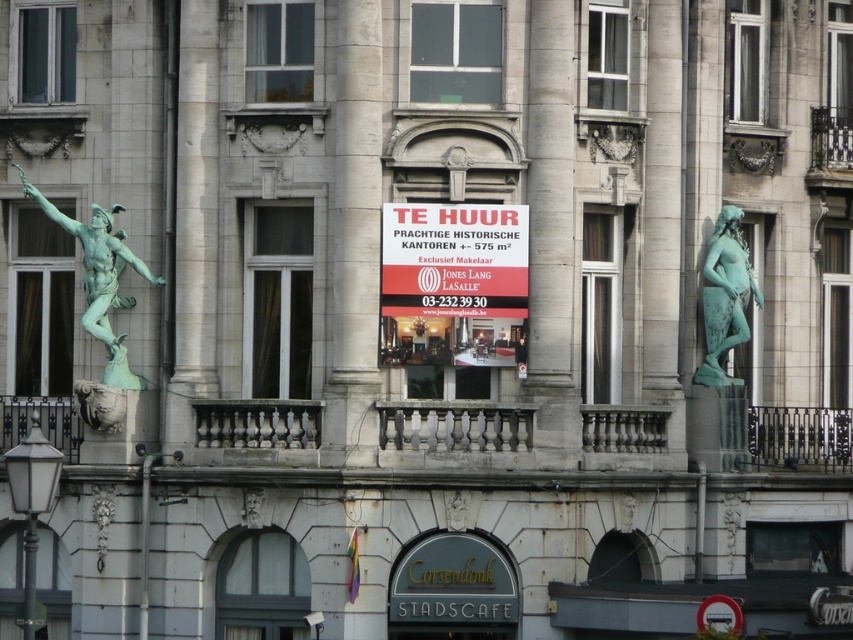
Question: Which object appears farthest from the camera in this image?

Choices:
 (A) green patina statue at left
 (B) red plastic sign at center
 (C) green patina statue at right
 (D) metallic circular sign at lower right

Answer: (C)

Question: Among these points, which one is nearest to the camera?

Choices:
 (A) (734, 609)
 (B) (759, 304)
 (C) (412, 209)

Answer: (A)

Question: Which point is closer to the camera taking this photo?

Choices:
 (A) (392, 221)
 (B) (730, 342)

Answer: (A)

Question: Does green patina statue at left lie behind metallic circular sign at lower right?

Choices:
 (A) no
 (B) yes

Answer: (B)

Question: Can you confirm if green patina statue at left is positioned to the right of metallic circular sign at lower right?

Choices:
 (A) no
 (B) yes

Answer: (A)

Question: Does red plastic sign at center appear over metallic circular sign at lower right?

Choices:
 (A) yes
 (B) no

Answer: (A)